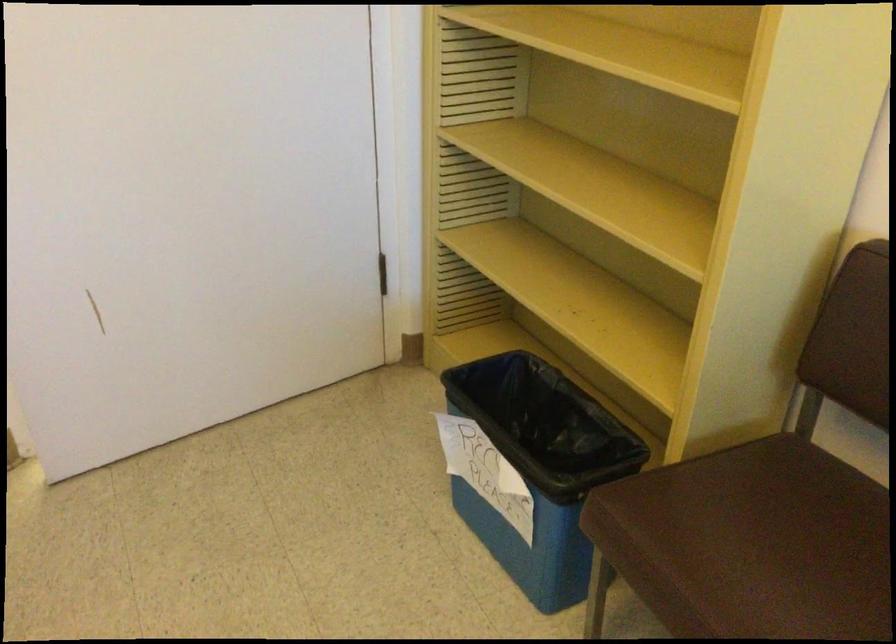
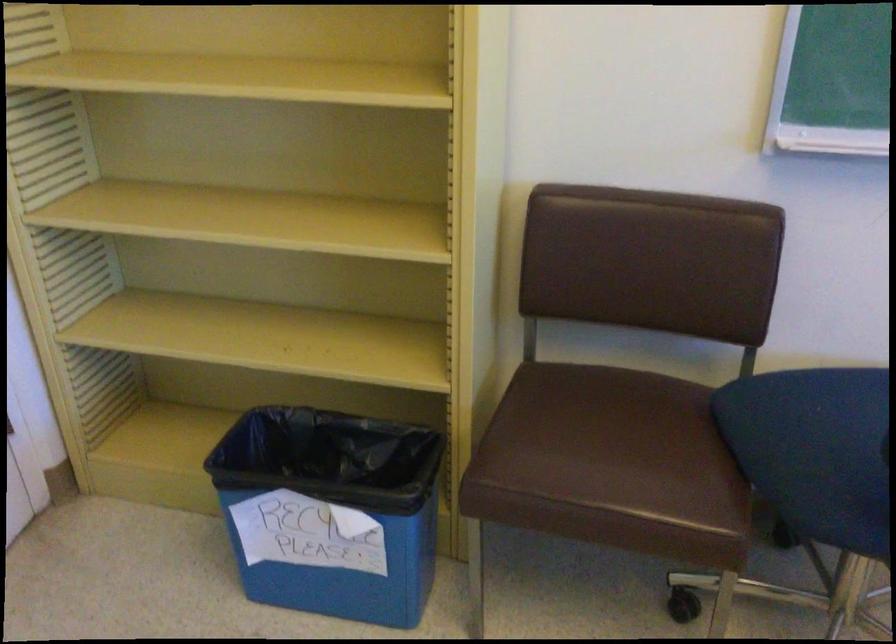
In the second image, find the point that corresponds to (501,464) in the first image.

(331, 511)